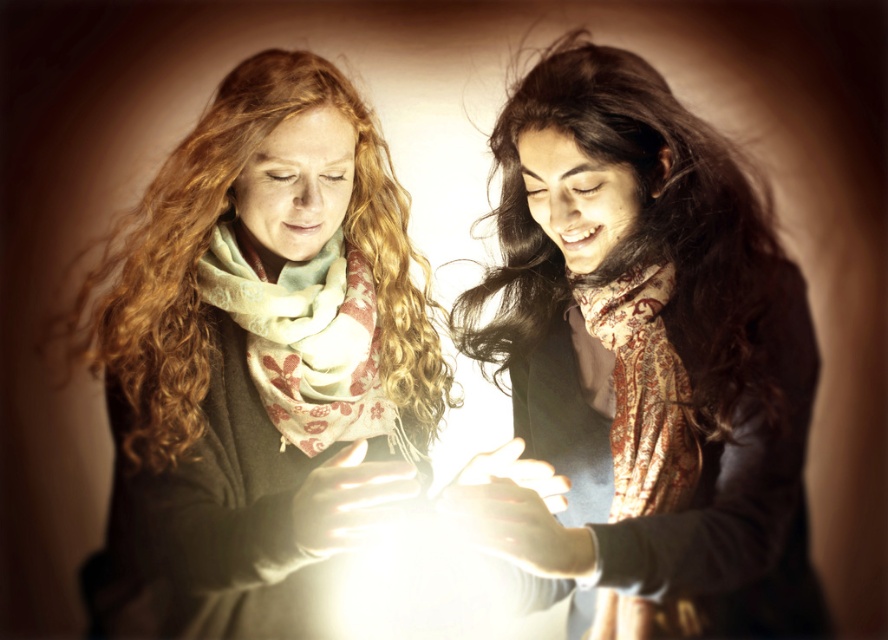
Can you confirm if brown paisley scarf at center is thinner than patterned silk scarf at right?

No, brown paisley scarf at center is not thinner than patterned silk scarf at right.

Who is positioned more to the right, brown paisley scarf at center or patterned silk scarf at right?

Positioned to the right is patterned silk scarf at right.

Does point (613, 202) come behind point (641, 314)?

No.

Locate an element on the screen. The image size is (888, 640). brown paisley scarf at center is located at coordinates (639, 355).

Is matte green scarf at center above patterned silk scarf at right?

Correct, matte green scarf at center is located above patterned silk scarf at right.

Can you confirm if matte green scarf at center is positioned to the left of patterned silk scarf at right?

Correct, you'll find matte green scarf at center to the left of patterned silk scarf at right.

You are a GUI agent. You are given a task and a screenshot of the screen. Output one action in this format:
    pyautogui.click(x=<x>, y=<y>)
    Task: Click on the matte green scarf at center
    The height and width of the screenshot is (640, 888).
    Given the screenshot: What is the action you would take?
    pyautogui.click(x=260, y=364)

Does light green floral scarf at center have a smaller size compared to patterned silk scarf at right?

Actually, light green floral scarf at center might be larger than patterned silk scarf at right.

Can you confirm if light green floral scarf at center is positioned to the right of patterned silk scarf at right?

Incorrect, light green floral scarf at center is not on the right side of patterned silk scarf at right.

Which is behind, point (385, 396) or point (654, 348)?

Point (385, 396)

You are a GUI agent. You are given a task and a screenshot of the screen. Output one action in this format:
    pyautogui.click(x=<x>, y=<y>)
    Task: Click on the light green floral scarf at center
    The width and height of the screenshot is (888, 640).
    Given the screenshot: What is the action you would take?
    pyautogui.click(x=307, y=340)